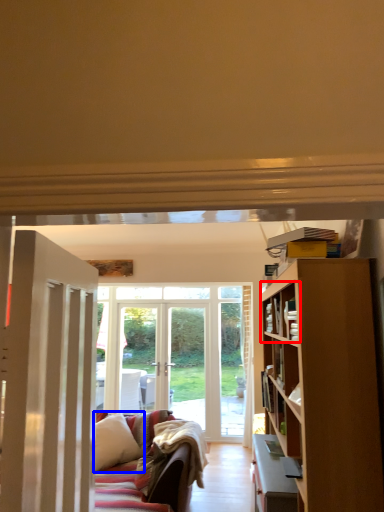
Question: Which object is further to the camera taking this photo, shelf (highlighted by a red box) or pillow (highlighted by a blue box)?

Choices:
 (A) shelf
 (B) pillow

Answer: (B)